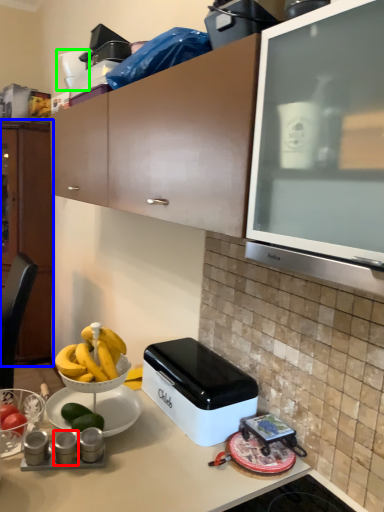
Question: Which object is the closest to the appliance (highlighted by a red box)? Choose among these: cabinetry (highlighted by a blue box) or appliance (highlighted by a green box).

Choices:
 (A) cabinetry
 (B) appliance

Answer: (B)